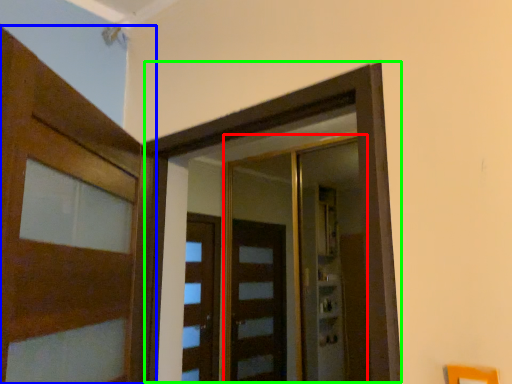
Question: Based on their relative distances, which object is farther from elevator (highlighted by a red box)? Choose from door (highlighted by a blue box) and elevator (highlighted by a green box).

Choices:
 (A) door
 (B) elevator

Answer: (A)